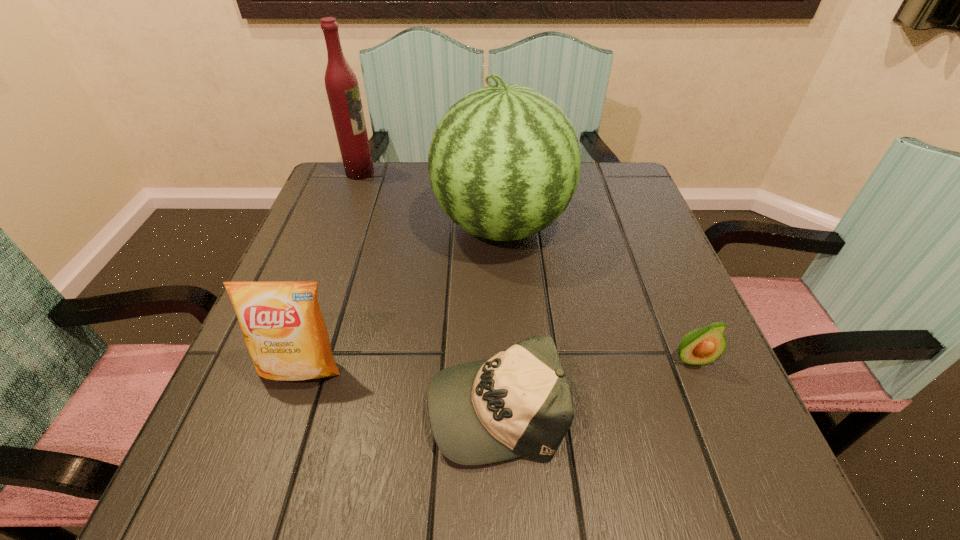
Find the location of `vacant area that lies between the fourth nearest object and the baseball cap`. vacant area that lies between the fourth nearest object and the baseball cap is located at coordinates (498, 315).

I want to click on vacant space that's between the baseball cap and the rightmost object, so click(594, 382).

Where is `free point between the rightmost object and the baseball cap`? Image resolution: width=960 pixels, height=540 pixels. free point between the rightmost object and the baseball cap is located at coordinates (594, 382).

I want to click on object identified as the second closest to the baseball cap, so click(x=702, y=346).

Where is `object that is the closest to the avocado`? The height and width of the screenshot is (540, 960). object that is the closest to the avocado is located at coordinates 518,403.

Identify the location of vacant space that satisfies the following two spatial constraints: 1. on the cut side of the rightmost object; 2. on the front-facing side of the baseball cap. Image resolution: width=960 pixels, height=540 pixels. (711, 405).

Find the location of `free location that satisfies the following two spatial constraints: 1. on the label of the farthest object; 2. on the back side of the watermelon`. free location that satisfies the following two spatial constraints: 1. on the label of the farthest object; 2. on the back side of the watermelon is located at coordinates (340, 226).

Image resolution: width=960 pixels, height=540 pixels. Identify the location of free space that satisfies the following two spatial constraints: 1. on the label of the farthest object; 2. on the right side of the watermelon. (340, 226).

I want to click on free location that satisfies the following two spatial constraints: 1. on the front side of the watermelon; 2. on the front-facing side of the shortest object, so click(x=512, y=405).